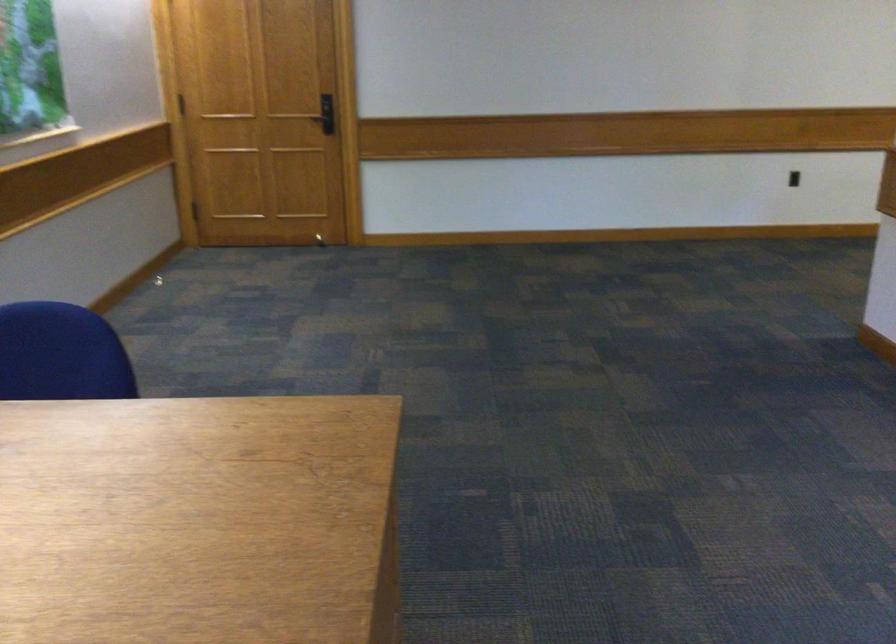
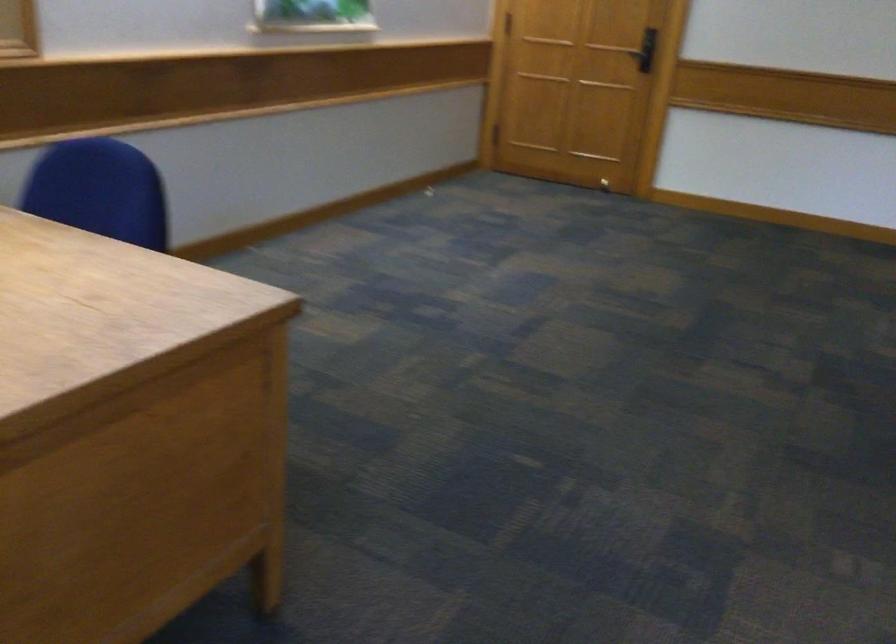
Find the pixel in the second image that matches pixel 270 152 in the first image.

(581, 89)